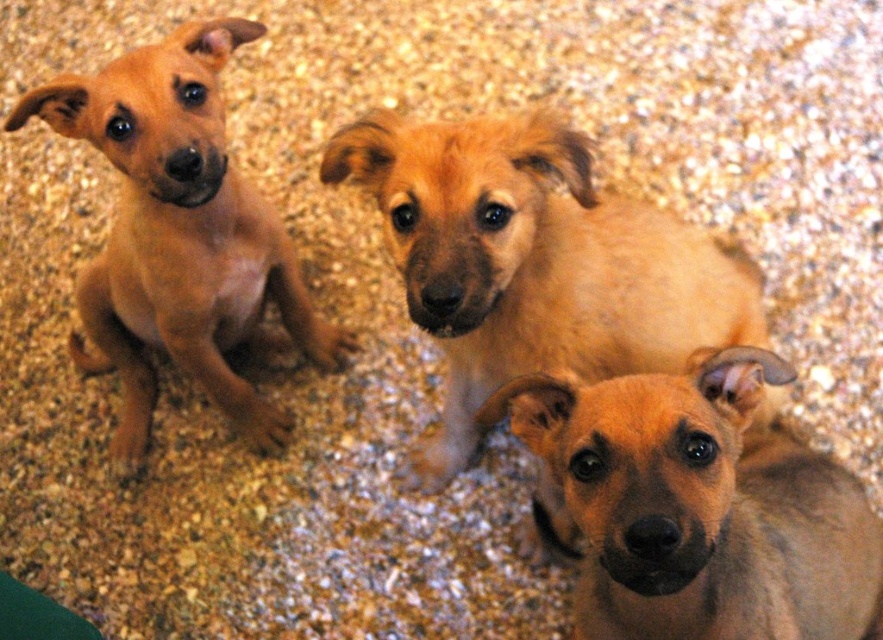
Does brown fur puppy at center have a greater width compared to matte brown puppy at left?

In fact, brown fur puppy at center might be narrower than matte brown puppy at left.

Is brown fur puppy at center closer to the viewer compared to matte brown puppy at left?

Yes, it is in front of matte brown puppy at left.

Who is more distant from viewer, (586, 492) or (134, 301)?

Positioned behind is point (134, 301).

Identify the location of brown fur puppy at center. The width and height of the screenshot is (883, 640). (700, 506).

Where is `light brown fur at center`? This screenshot has height=640, width=883. light brown fur at center is located at coordinates (534, 262).

Is light brown fur at center positioned before matte brown puppy at left?

That is True.

Is point (434, 173) farther from camera compared to point (240, 413)?

No, (434, 173) is in front of (240, 413).

Where is `light brown fur at center`? This screenshot has height=640, width=883. light brown fur at center is located at coordinates (534, 262).

Is light brown fur at center wider than brown fur puppy at center?

Correct, the width of light brown fur at center exceeds that of brown fur puppy at center.

Can you confirm if light brown fur at center is positioned above brown fur puppy at center?

Correct, light brown fur at center is located above brown fur puppy at center.

Is point (565, 268) behind point (668, 452)?

Yes, it is behind point (668, 452).

Image resolution: width=883 pixels, height=640 pixels. What are the coordinates of `light brown fur at center` in the screenshot? It's located at (534, 262).